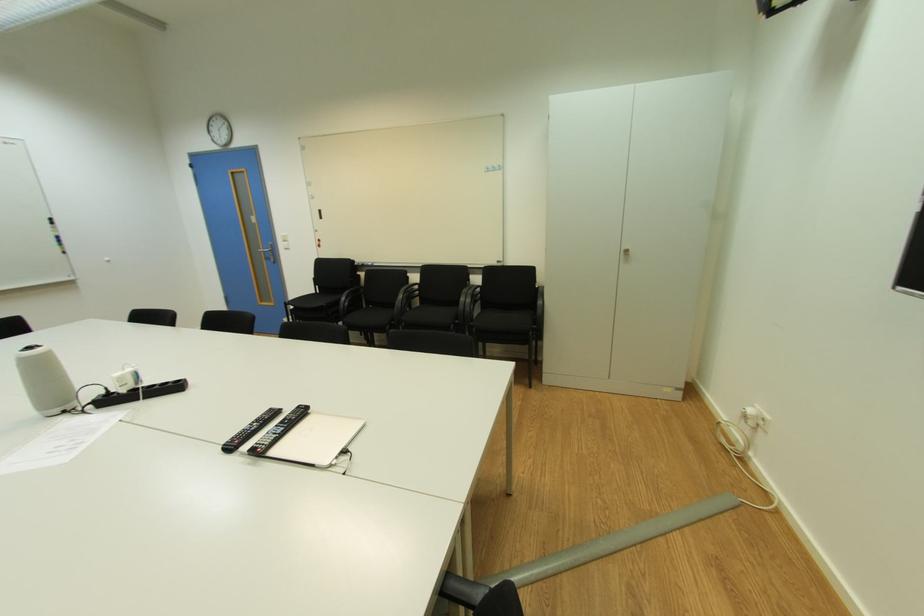
Find the location of a particular element. white power adapter is located at coordinates (745, 447).